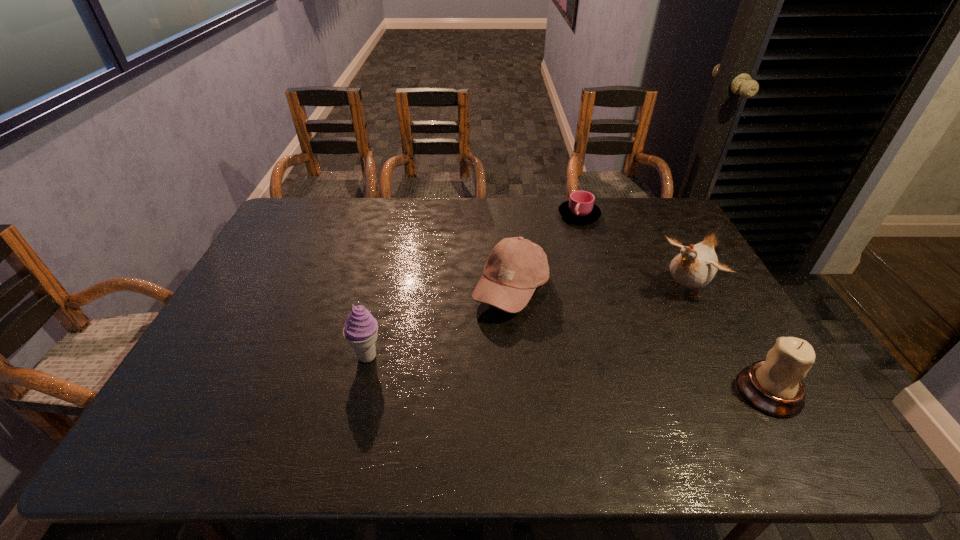
Locate an element on the screen. The height and width of the screenshot is (540, 960). vacant space located on the side with the handle of the cup is located at coordinates (580, 237).

You are a GUI agent. You are given a task and a screenshot of the screen. Output one action in this format:
    pyautogui.click(x=<x>, y=<y>)
    Task: Click on the free space located on the side with the handle of the cup
    The height and width of the screenshot is (540, 960).
    Given the screenshot: What is the action you would take?
    pyautogui.click(x=582, y=283)

Where is `vacant space located at the beak of the bird`? The image size is (960, 540). vacant space located at the beak of the bird is located at coordinates (637, 329).

Locate an element on the screen. This screenshot has height=540, width=960. free space located at the beak of the bird is located at coordinates (650, 319).

Locate an element on the screen. Image resolution: width=960 pixels, height=540 pixels. vacant region located 0.050m at the beak of the bird is located at coordinates click(662, 309).

Where is `vacant space located 0.120m on the front-facing side of the baseball cap`? This screenshot has height=540, width=960. vacant space located 0.120m on the front-facing side of the baseball cap is located at coordinates (561, 350).

Where is `free space located on the front-facing side of the baseball cap`? This screenshot has height=540, width=960. free space located on the front-facing side of the baseball cap is located at coordinates (565, 355).

Locate an element on the screen. This screenshot has width=960, height=540. vacant space located on the front-facing side of the baseball cap is located at coordinates (549, 337).

Locate an element on the screen. This screenshot has height=540, width=960. object at the far edge is located at coordinates (580, 208).

Locate an element on the screen. The height and width of the screenshot is (540, 960). object that is at the near edge is located at coordinates (774, 386).